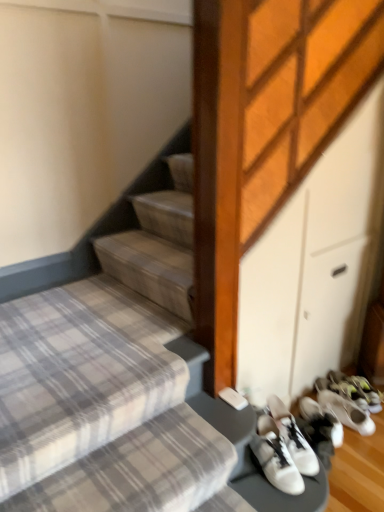
What do you see at coordinates (345, 405) in the screenshot? This screenshot has width=384, height=512. I see `white matte sneakers at lower right, positioned as the first footwear in right-to-left order` at bounding box center [345, 405].

What do you see at coordinates (361, 466) in the screenshot? I see `white leather sneakers at lower right, the second footwear viewed from the back` at bounding box center [361, 466].

What do you see at coordinates (149, 365) in the screenshot? I see `plaid fabric stairs at lower left` at bounding box center [149, 365].

In order to click on white matte sneakers at lower right, which is the second footwear from left to right in this screenshot , I will do `click(345, 405)`.

Considering the relative positions of white leather sneakers at lower right, the second footwear viewed from the back, and white matte sneakers at lower right, which is the second footwear from left to right, in the image provided, is white leather sneakers at lower right, the second footwear viewed from the back, behind white matte sneakers at lower right, which is the second footwear from left to right,?

No, white leather sneakers at lower right, the second footwear viewed from the back, is closer to the viewer.

From a real-world perspective, is white leather sneakers at lower right, positioned as the 2th footwear in right-to-left order, physically located above or below white matte sneakers at lower right, which is counted as the 1th footwear, starting from the back?

In terms of real-world spatial position, white leather sneakers at lower right, positioned as the 2th footwear in right-to-left order, is above white matte sneakers at lower right, which is counted as the 1th footwear, starting from the back.

Can you confirm if white leather sneakers at lower right, arranged as the first footwear when viewed from the left, is taller than white matte sneakers at lower right, positioned as the first footwear in right-to-left order?

Correct, white leather sneakers at lower right, arranged as the first footwear when viewed from the left, is much taller as white matte sneakers at lower right, positioned as the first footwear in right-to-left order.

Considering the relative sizes of white matte sneakers at lower right, which is the second footwear from left to right, and plaid fabric stairs at lower left in the image provided, is white matte sneakers at lower right, which is the second footwear from left to right, smaller than plaid fabric stairs at lower left?

Indeed, white matte sneakers at lower right, which is the second footwear from left to right, has a smaller size compared to plaid fabric stairs at lower left.

From the image's perspective, between white matte sneakers at lower right, arranged as the second footwear when viewed from the front, and plaid fabric stairs at lower left, which one is located above?

From the image's view, plaid fabric stairs at lower left is above.

Can you tell me how much white matte sneakers at lower right, which is counted as the 1th footwear, starting from the back, and plaid fabric stairs at lower left differ in facing direction?

They differ by 1.69 degrees in their facing directions.

Who is taller, white matte sneakers at lower right, which is counted as the 1th footwear, starting from the back, or plaid fabric stairs at lower left?

plaid fabric stairs at lower left is taller.

From a real-world perspective, is white matte sneakers at lower right, positioned as the first footwear in right-to-left order, positioned above or below white leather sneakers at lower right, the second footwear viewed from the back?

white matte sneakers at lower right, positioned as the first footwear in right-to-left order, is below white leather sneakers at lower right, the second footwear viewed from the back.

From the image's perspective, which one is positioned lower, white matte sneakers at lower right, which is the second footwear from left to right, or white leather sneakers at lower right, which is the 1th footwear from front to back?

white leather sneakers at lower right, which is the 1th footwear from front to back, is shown below in the image.

Consider the image. Are white matte sneakers at lower right, which is counted as the 1th footwear, starting from the back, and white leather sneakers at lower right, the second footwear viewed from the back, beside each other?

white matte sneakers at lower right, which is counted as the 1th footwear, starting from the back, and white leather sneakers at lower right, the second footwear viewed from the back, are not in contact.

Is white matte sneakers at lower right, which is counted as the 1th footwear, starting from the back, to the right of white leather sneakers at lower right, positioned as the 2th footwear in right-to-left order, from the viewer's perspective?

Correct, you'll find white matte sneakers at lower right, which is counted as the 1th footwear, starting from the back, to the right of white leather sneakers at lower right, positioned as the 2th footwear in right-to-left order.

From the image's perspective, which is above, plaid fabric stairs at lower left or white matte sneakers at lower right, which is counted as the 1th footwear, starting from the back?

plaid fabric stairs at lower left appears higher in the image.

Is point (144, 458) behind point (353, 401)?

No, it is in front of (353, 401).

Is plaid fabric stairs at lower left taller than white matte sneakers at lower right, which is the second footwear from left to right?

Yes.

Can we say plaid fabric stairs at lower left lies outside white matte sneakers at lower right, which is the second footwear from left to right?

Yes, plaid fabric stairs at lower left is outside of white matte sneakers at lower right, which is the second footwear from left to right.

Considering the relative sizes of plaid fabric stairs at lower left and white leather sneakers at lower right, arranged as the first footwear when viewed from the left, in the image provided, is plaid fabric stairs at lower left taller than white leather sneakers at lower right, arranged as the first footwear when viewed from the left,?

Yes, plaid fabric stairs at lower left is taller than white leather sneakers at lower right, arranged as the first footwear when viewed from the left.

Who is smaller, plaid fabric stairs at lower left or white leather sneakers at lower right, the second footwear viewed from the back?

white leather sneakers at lower right, the second footwear viewed from the back.

Considering their positions, is plaid fabric stairs at lower left located in front of or behind white leather sneakers at lower right, arranged as the first footwear when viewed from the left?

Visually, plaid fabric stairs at lower left is located in front of white leather sneakers at lower right, arranged as the first footwear when viewed from the left.

Does plaid fabric stairs at lower left contain white leather sneakers at lower right, which is the 1th footwear from front to back?

No, white leather sneakers at lower right, which is the 1th footwear from front to back, is not inside plaid fabric stairs at lower left.

Is white leather sneakers at lower right, arranged as the first footwear when viewed from the left, aimed at plaid fabric stairs at lower left?

No, white leather sneakers at lower right, arranged as the first footwear when viewed from the left, is not facing towards plaid fabric stairs at lower left.

Is white leather sneakers at lower right, which is the 1th footwear from front to back, shorter than plaid fabric stairs at lower left?

Correct, white leather sneakers at lower right, which is the 1th footwear from front to back, is not as tall as plaid fabric stairs at lower left.

Does white leather sneakers at lower right, positioned as the 2th footwear in right-to-left order, have a larger size compared to plaid fabric stairs at lower left?

No, white leather sneakers at lower right, positioned as the 2th footwear in right-to-left order, is not bigger than plaid fabric stairs at lower left.

Between white leather sneakers at lower right, which is the 1th footwear from front to back, and plaid fabric stairs at lower left, which one is positioned in front?

Positioned in front is plaid fabric stairs at lower left.

Locate an element on the screen. The image size is (384, 512). footwear above the white matte sneakers at lower right, arranged as the second footwear when viewed from the front (from a real-world perspective) is located at coordinates point(361,466).

The image size is (384, 512). In order to click on stairs that appears on the left of white matte sneakers at lower right, which is the second footwear from left to right in this screenshot , I will do `click(149, 365)`.

From the image, which object appears to be nearer to white matte sneakers at lower right, positioned as the first footwear in right-to-left order, plaid fabric stairs at lower left or white leather sneakers at lower right, which is the 1th footwear from front to back?

The object closer to white matte sneakers at lower right, positioned as the first footwear in right-to-left order, is white leather sneakers at lower right, which is the 1th footwear from front to back.

Looking at this image, estimate the real-world distances between objects in this image. Which object is further from white matte sneakers at lower right, which is the second footwear from left to right, white leather sneakers at lower right, which is the 1th footwear from front to back, or plaid fabric stairs at lower left?

Among the two, plaid fabric stairs at lower left is located further to white matte sneakers at lower right, which is the second footwear from left to right.

Based on their spatial positions, is white leather sneakers at lower right, the second footwear viewed from the back, or white matte sneakers at lower right, arranged as the second footwear when viewed from the front, further from plaid fabric stairs at lower left?

Among the two, white matte sneakers at lower right, arranged as the second footwear when viewed from the front, is located further to plaid fabric stairs at lower left.

Based on their spatial positions, is plaid fabric stairs at lower left or white matte sneakers at lower right, arranged as the second footwear when viewed from the front, closer to white leather sneakers at lower right, which is the 1th footwear from front to back?

white matte sneakers at lower right, arranged as the second footwear when viewed from the front.

When comparing their distances from plaid fabric stairs at lower left, does white matte sneakers at lower right, which is the second footwear from left to right, or white leather sneakers at lower right, positioned as the 2th footwear in right-to-left order, seem closer?

The object closer to plaid fabric stairs at lower left is white leather sneakers at lower right, positioned as the 2th footwear in right-to-left order.

Which object lies further to the anchor point white leather sneakers at lower right, positioned as the 2th footwear in right-to-left order, white matte sneakers at lower right, which is the second footwear from left to right, or plaid fabric stairs at lower left?

plaid fabric stairs at lower left lies further to white leather sneakers at lower right, positioned as the 2th footwear in right-to-left order, than the other object.

Locate an element on the screen. footwear between plaid fabric stairs at lower left and white matte sneakers at lower right, which is the second footwear from left to right is located at coordinates (361, 466).